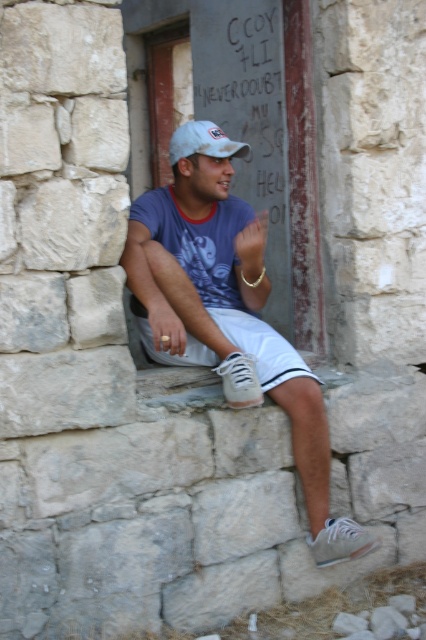
From the picture: Does white cotton shorts at center have a larger size compared to white matte cap at center?

Correct, white cotton shorts at center is larger in size than white matte cap at center.

Does white cotton shorts at center appear over white matte cap at center?

Incorrect, white cotton shorts at center is not positioned above white matte cap at center.

Locate an element on the screen. The height and width of the screenshot is (640, 426). white cotton shorts at center is located at coordinates (261, 346).

This screenshot has width=426, height=640. What do you see at coordinates (229, 321) in the screenshot?
I see `white matte sneakers at lower center` at bounding box center [229, 321].

Which is behind, point (239, 401) or point (270, 83)?

The point (270, 83) is behind.

The height and width of the screenshot is (640, 426). Find the location of `white matte sneakers at lower center`. white matte sneakers at lower center is located at coordinates (229, 321).

Does white matte sneakers at lower center appear on the left side of white matte cap at center?

No, white matte sneakers at lower center is not to the left of white matte cap at center.

Is white matte sneakers at lower center closer to the viewer compared to white matte cap at center?

That is True.

Which is behind, point (227, 388) or point (184, 128)?

Positioned behind is point (184, 128).

Identify the location of white matte sneakers at lower center. This screenshot has height=640, width=426. (229, 321).